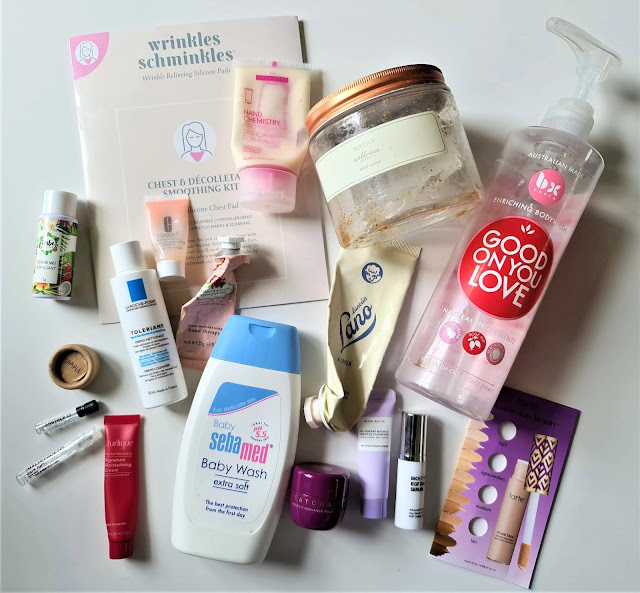
In order to click on dispenser in this screenshot , I will do `click(596, 50)`.